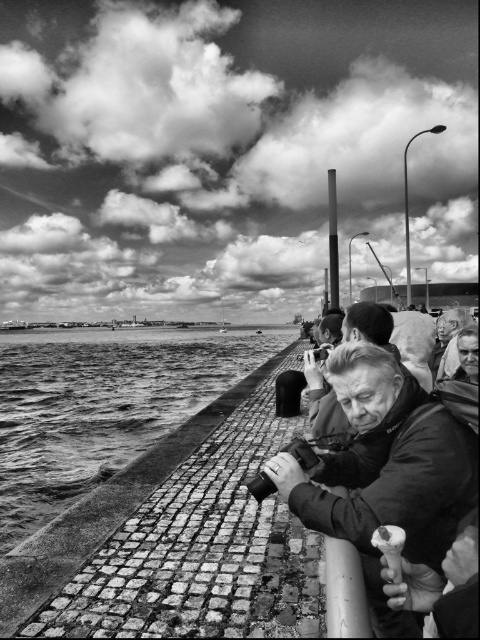
Can you confirm if rough stone water at lower left is positioned below smooth leather jacket at center?

Yes, rough stone water at lower left is below smooth leather jacket at center.

Does rough stone water at lower left appear on the left side of smooth leather jacket at center?

Indeed, rough stone water at lower left is positioned on the left side of smooth leather jacket at center.

Which is in front, point (24, 458) or point (324, 426)?

Positioned in front is point (324, 426).

Where is `rough stone water at lower left`? rough stone water at lower left is located at coordinates (100, 410).

The height and width of the screenshot is (640, 480). What do you see at coordinates (100, 410) in the screenshot?
I see `rough stone water at lower left` at bounding box center [100, 410].

Identify the location of rough stone water at lower left. (100, 410).

Image resolution: width=480 pixels, height=640 pixels. Identify the location of rough stone water at lower left. (100, 410).

Consider the image. Which is more to the left, matte black camera at center or smooth leather jacket at center?

smooth leather jacket at center

Is point (287, 480) positioned behind point (381, 307)?

No, it is not.

Find the location of a particular element. Image resolution: width=480 pixels, height=640 pixels. matte black camera at center is located at coordinates (385, 472).